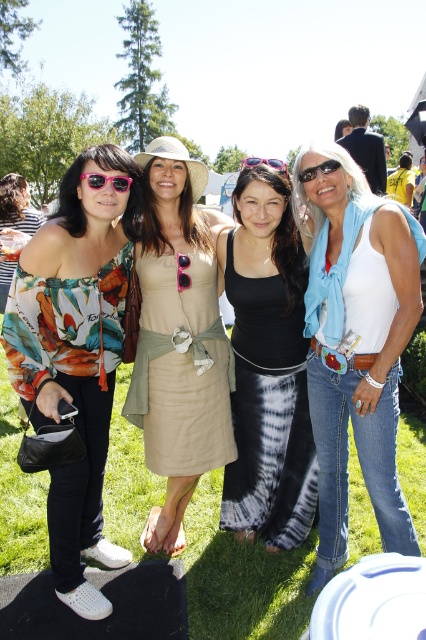
Question: Can you confirm if sunglasses at upper right is positioned to the right of matte black sunglasses at center?

Choices:
 (A) no
 (B) yes

Answer: (A)

Question: Can you confirm if pink plastic sunglasses at center is smaller than sunglasses at upper right?

Choices:
 (A) no
 (B) yes

Answer: (A)

Question: Which point is farther from the camera taking this photo?

Choices:
 (A) (34, 244)
 (B) (330, 438)
 (C) (307, 168)
 (D) (135, 376)

Answer: (D)

Question: Is green grass at lower center thinner than black tie-dye skirt at center?

Choices:
 (A) no
 (B) yes

Answer: (A)

Question: Based on their relative distances, which object is farther from the green grass at lower center?

Choices:
 (A) floral print off-shoulder top at left
 (B) beige linen dress at center
 (C) white cotton tank top at center
 (D) black tie-dye skirt at center

Answer: (C)

Question: Which point is farther from the camera taking this photo?

Choices:
 (A) (94, 417)
 (B) (241, 164)
 (C) (172, 406)
 (D) (236, 573)

Answer: (B)